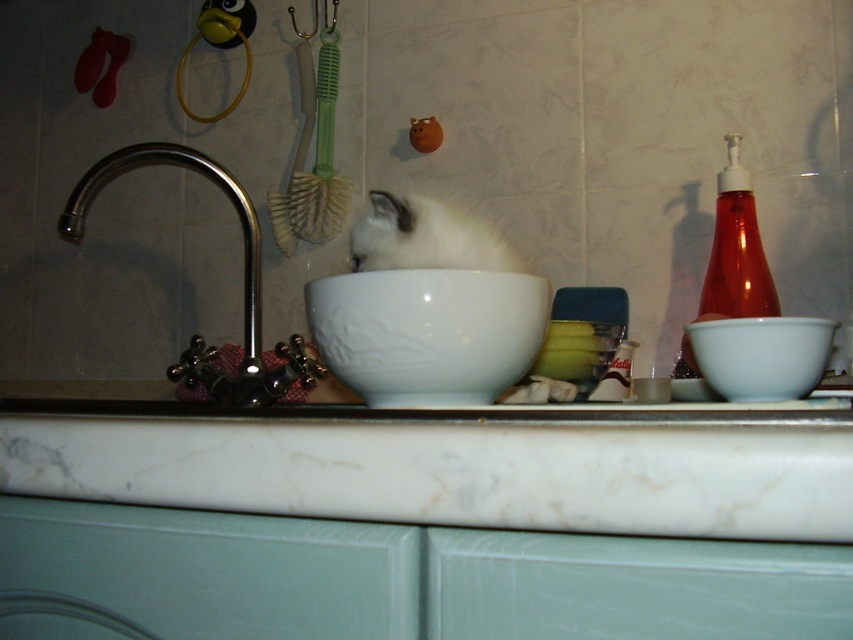
Question: Which object is the closest to the white marble counter at center?

Choices:
 (A) polished chrome faucet at left
 (B) white glossy bowl at center

Answer: (B)

Question: Does white marble counter at center lie in front of white glossy bowl at right?

Choices:
 (A) no
 (B) yes

Answer: (B)

Question: Considering the real-world distances, which object is closest to the polished chrome faucet at left?

Choices:
 (A) white marble counter at center
 (B) white glossy bowl at center
 (C) white fur cat at center
 (D) white glossy bowl at right

Answer: (C)

Question: Which of the following is the closest to the observer?

Choices:
 (A) white marble counter at center
 (B) white glossy bowl at right
 (C) white glossy bowl at center
 (D) polished chrome faucet at left

Answer: (A)

Question: Is white fur cat at center in front of polished chrome faucet at left?

Choices:
 (A) yes
 (B) no

Answer: (A)

Question: Can you confirm if white fur cat at center is positioned to the right of polished chrome faucet at left?

Choices:
 (A) yes
 (B) no

Answer: (A)